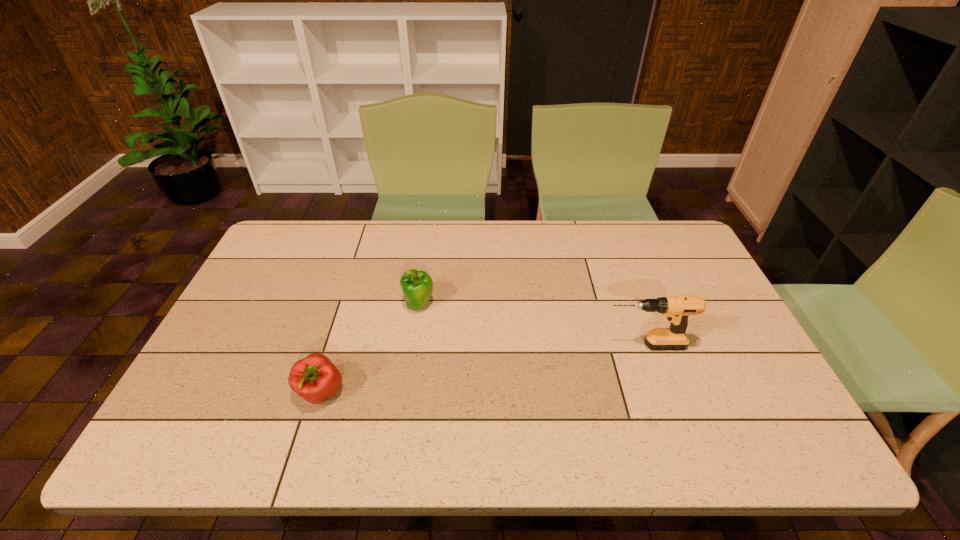
The width and height of the screenshot is (960, 540). In order to click on free space located on the back of the leftmost object in this screenshot , I will do `click(334, 350)`.

Locate an element on the screen. object situated at the right edge is located at coordinates (677, 309).

I want to click on vacant area at the far edge of the desktop, so point(470,263).

This screenshot has height=540, width=960. In order to click on vacant space at the near edge of the desktop in this screenshot , I will do `click(345, 446)`.

You are a GUI agent. You are given a task and a screenshot of the screen. Output one action in this format:
    pyautogui.click(x=<x>, y=<y>)
    Task: Click on the vacant space at the left edge of the desktop
    The width and height of the screenshot is (960, 540).
    Given the screenshot: What is the action you would take?
    pyautogui.click(x=259, y=362)

You are a GUI agent. You are given a task and a screenshot of the screen. Output one action in this format:
    pyautogui.click(x=<x>, y=<y>)
    Task: Click on the vacant space at the right edge
    
    Given the screenshot: What is the action you would take?
    pyautogui.click(x=724, y=383)

Where is `vacant space at the far left corner`? The width and height of the screenshot is (960, 540). vacant space at the far left corner is located at coordinates (290, 228).

This screenshot has width=960, height=540. Identify the location of free space at the far right corner. pyautogui.click(x=676, y=239).

Where is `free space between the second farthest object and the nearest object`? The image size is (960, 540). free space between the second farthest object and the nearest object is located at coordinates (483, 369).

At what (x,y) coordinates should I click in order to perform the action: click on unoccupied area between the second object from right to left and the nearer bell pepper. Please return your answer as a coordinate pair (x, y). The height and width of the screenshot is (540, 960). Looking at the image, I should click on (370, 349).